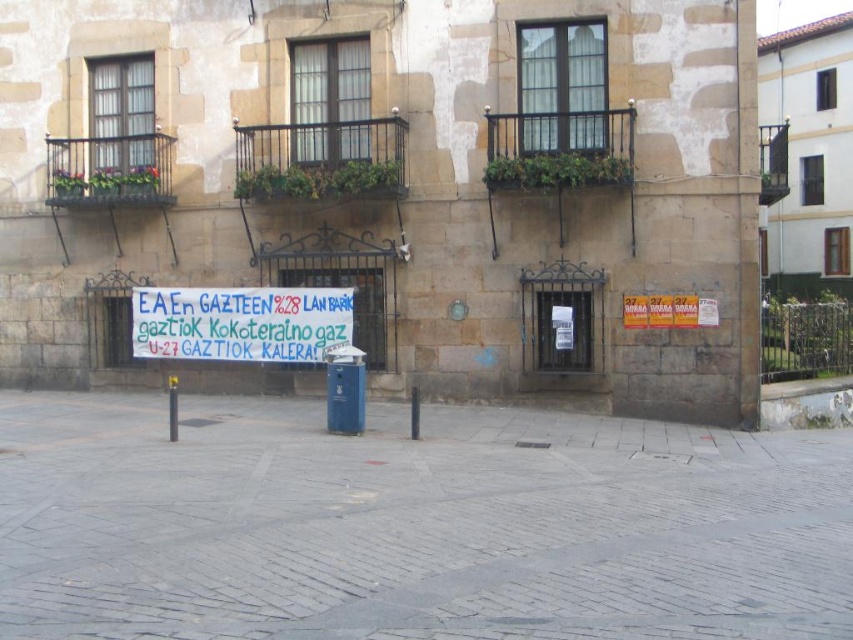
How distant is white paper banner at center from yellow plastic pole at center?

They are 5.63 feet apart.

Which is more to the left, white paper banner at center or yellow plastic pole at center?

From the viewer's perspective, yellow plastic pole at center appears more on the left side.

Who is more forward, (241,346) or (172,384)?

Point (241,346) is in front.

Image resolution: width=853 pixels, height=640 pixels. What are the coordinates of `white paper banner at center` in the screenshot? It's located at (241, 323).

Who is lower down, white paper banner at center or black plastic pole at center?

black plastic pole at center is lower down.

Who is positioned more to the left, white paper banner at center or black plastic pole at center?

Positioned to the left is white paper banner at center.

Is point (149, 298) closer to viewer compared to point (410, 397)?

No, (149, 298) is further to viewer.

Find the location of `white paper banner at center`. white paper banner at center is located at coordinates (241, 323).

Does gray cobblestone pavement at center appear on the left side of black plastic pole at center?

No, gray cobblestone pavement at center is not to the left of black plastic pole at center.

Between point (701, 630) and point (413, 413), which one is positioned behind?

Positioned behind is point (413, 413).

This screenshot has height=640, width=853. What are the coordinates of `gray cobblestone pavement at center` in the screenshot? It's located at click(413, 525).